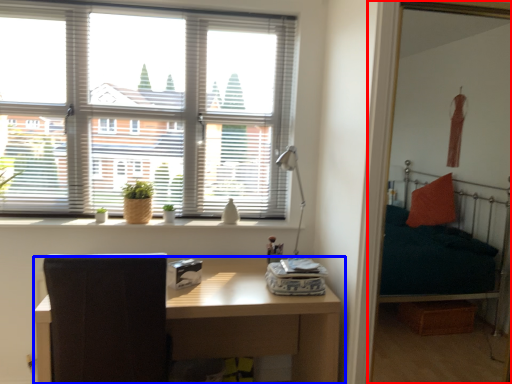
Question: Among these objects, which one is farthest to the camera, bunk bed (highlighted by a red box) or table (highlighted by a blue box)?

Choices:
 (A) bunk bed
 (B) table

Answer: (A)